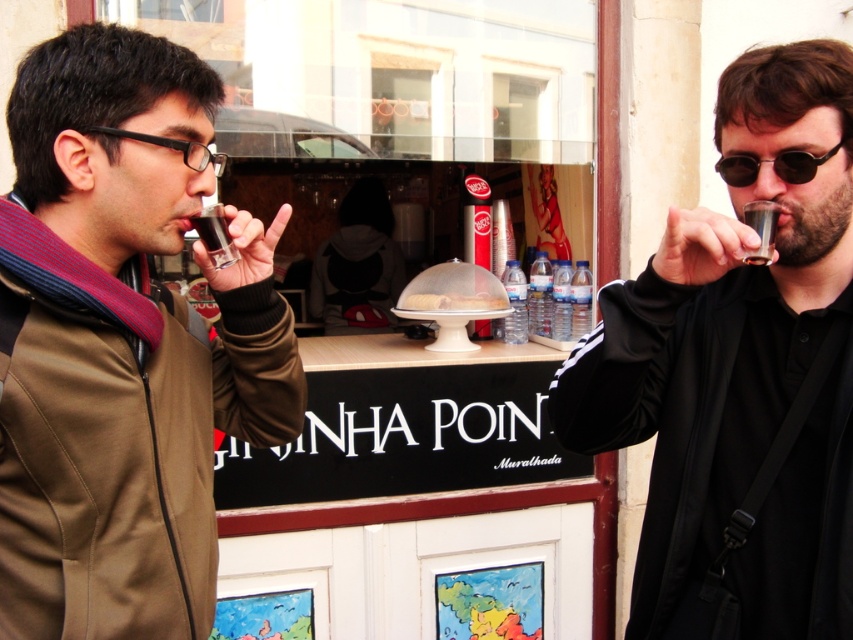
Is black matte jacket at right shorter than dark brown liquid at upper center?

In fact, black matte jacket at right may be taller than dark brown liquid at upper center.

Does point (767, 116) come closer to viewer compared to point (764, 260)?

No, (767, 116) is further to viewer.

Is point (578, 435) behind point (762, 220)?

Yes, it is.

Where is `black matte jacket at right`? This screenshot has height=640, width=853. black matte jacket at right is located at coordinates (740, 368).

Is transparent plastic water bottles at center bigger than clear plastic water bottles at center?

Incorrect, transparent plastic water bottles at center is not larger than clear plastic water bottles at center.

Does transparent plastic water bottles at center appear under clear plastic water bottles at center?

No, transparent plastic water bottles at center is not below clear plastic water bottles at center.

Image resolution: width=853 pixels, height=640 pixels. What do you see at coordinates (540, 296) in the screenshot?
I see `transparent plastic water bottles at center` at bounding box center [540, 296].

This screenshot has width=853, height=640. Find the location of `transparent plastic water bottles at center`. transparent plastic water bottles at center is located at coordinates (540, 296).

Who is shorter, black plastic goggles at upper right or clear plastic water bottles at center?

Standing shorter between the two is black plastic goggles at upper right.

Between black plastic goggles at upper right and clear plastic water bottles at center, which one appears on the right side from the viewer's perspective?

From the viewer's perspective, black plastic goggles at upper right appears more on the right side.

Where is `black plastic goggles at upper right`? black plastic goggles at upper right is located at coordinates (772, 166).

The image size is (853, 640). I want to click on black plastic goggles at upper right, so point(772,166).